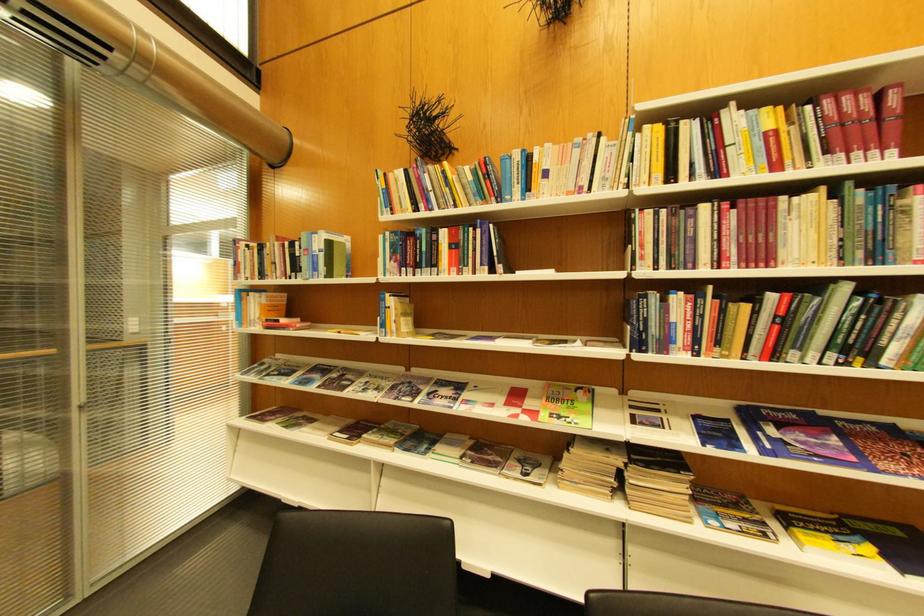
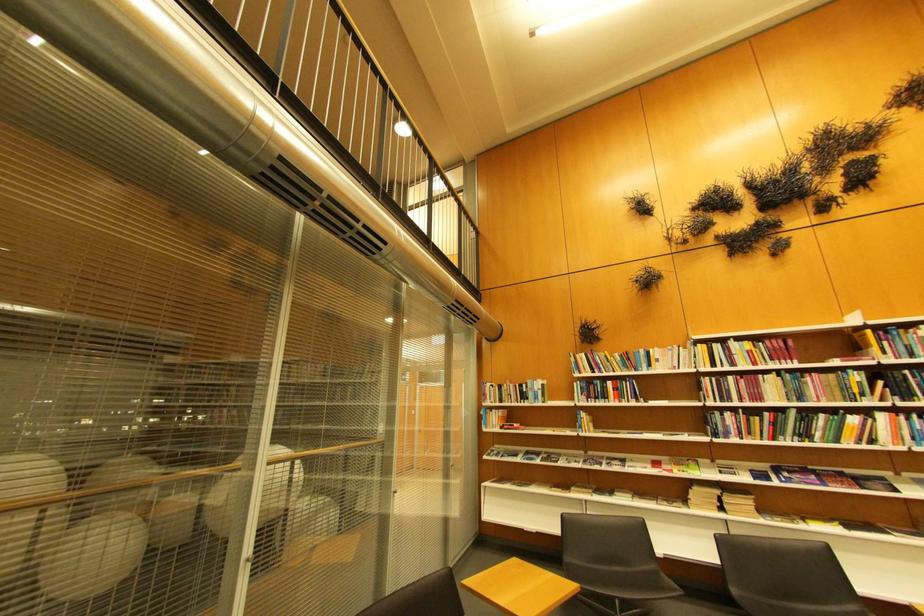
In the second image, find the point that corresponds to point (715, 209) in the first image.

(740, 379)